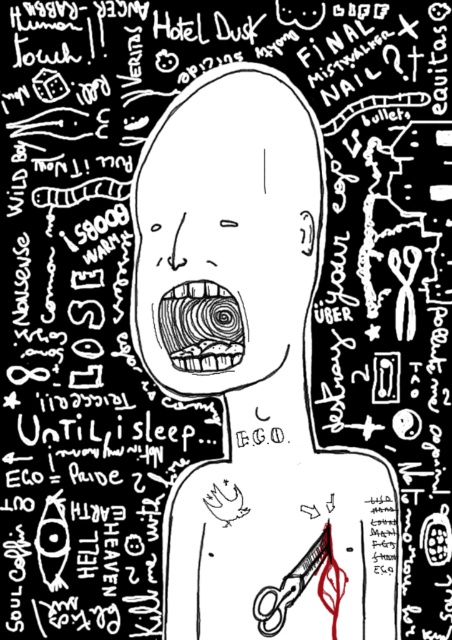
Question: Is spiral-patterned teeth at center closer to the viewer compared to metallic sheen scissors at lower right?

Choices:
 (A) yes
 (B) no

Answer: (A)

Question: Which of the following is the closest to the observer?

Choices:
 (A) (330, 560)
 (B) (285, 80)

Answer: (B)

Question: Which of the following is the closest to the observer?

Choices:
 (A) pos(172,321)
 (B) pos(254,609)
 (C) pos(279,122)

Answer: (C)

Question: Does spiral-patterned teeth at center have a smaller size compared to metallic sheen scissors at lower right?

Choices:
 (A) yes
 (B) no

Answer: (A)

Question: Considering the relative positions of spiral-patterned teeth at center and metallic sheen scissors at lower right in the image provided, where is spiral-patterned teeth at center located with respect to metallic sheen scissors at lower right?

Choices:
 (A) left
 (B) right

Answer: (A)

Question: Which point is farther to the camera?

Choices:
 (A) (273, 84)
 (B) (199, 356)
 (C) (259, 618)

Answer: (B)